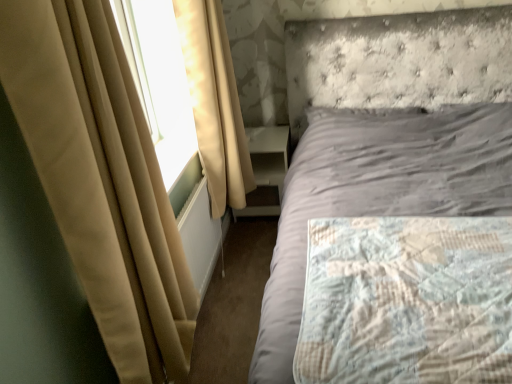
Question: Considering the positions of white glossy nightstand at center and beige fabric curtain at left, the second curtain from the front, in the image, is white glossy nightstand at center bigger or smaller than beige fabric curtain at left, the second curtain from the front,?

Choices:
 (A) small
 (B) big

Answer: (A)

Question: In the image, is white glossy nightstand at center positioned in front of or behind beige fabric curtain at left, the second curtain from the front?

Choices:
 (A) front
 (B) behind

Answer: (B)

Question: Which is farther from the white plastic radiator at lower left?

Choices:
 (A) quilted fabric mattress at right
 (B) beige fabric curtain at left, which is the 1th curtain from back to front
 (C) beige fabric curtain at left, placed as the first curtain when sorted from front to back
 (D) white glossy nightstand at center

Answer: (A)

Question: Which object is positioned closest to the beige fabric curtain at left, the second curtain from the front?

Choices:
 (A) quilted fabric mattress at right
 (B) white plastic radiator at lower left
 (C) white glossy nightstand at center
 (D) beige fabric curtain at left, placed as the first curtain when sorted from front to back

Answer: (B)